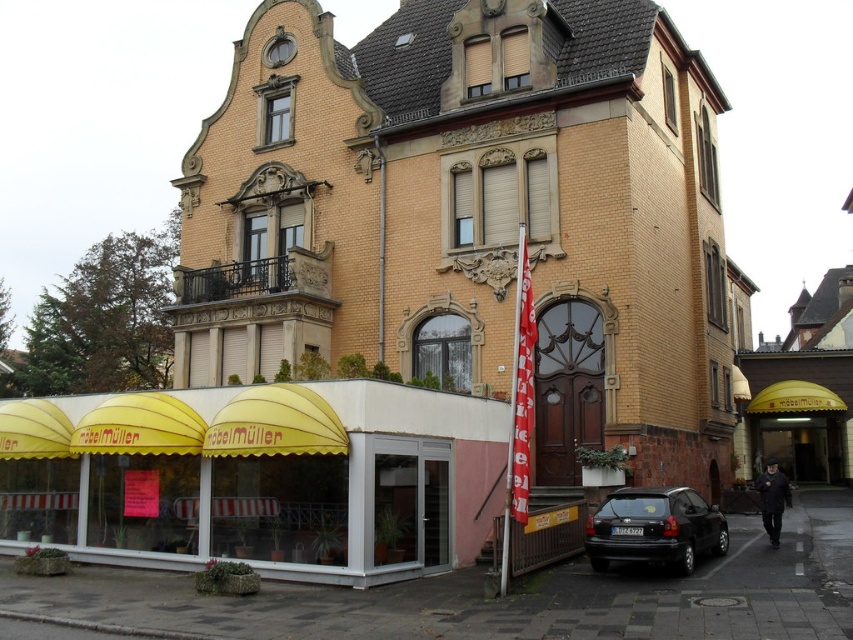
Question: Can you confirm if yellow fabric awning at lower left is positioned to the left of yellow fabric canopy at center?

Choices:
 (A) yes
 (B) no

Answer: (A)

Question: Is yellow fabric awning at lower left positioned in front of black matte hatchback at lower right?

Choices:
 (A) no
 (B) yes

Answer: (A)

Question: Which object is positioned farthest from the yellow brick building at center?

Choices:
 (A) yellow fabric canopy at center
 (B) black matte hatchback at lower right

Answer: (A)

Question: Among these points, which one is farthest from the camera?

Choices:
 (A) click(x=584, y=140)
 (B) click(x=605, y=568)

Answer: (A)

Question: Is yellow fabric awning at lower left wider than yellow fabric canopy at center?

Choices:
 (A) no
 (B) yes

Answer: (B)

Question: Which of the following is the closest to the observer?

Choices:
 (A) black matte hatchback at lower right
 (B) yellow fabric canopy at center
 (C) yellow brick building at center

Answer: (A)